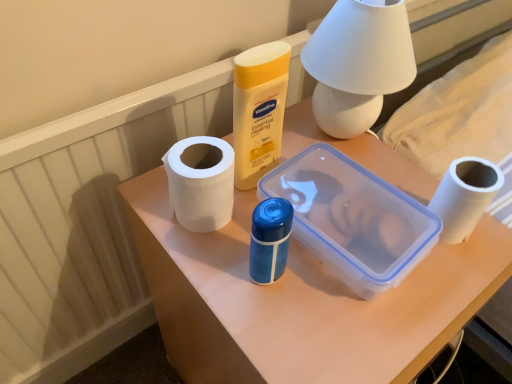
This screenshot has height=384, width=512. I want to click on free space to the left of white matte toilet paper at right, so click(321, 259).